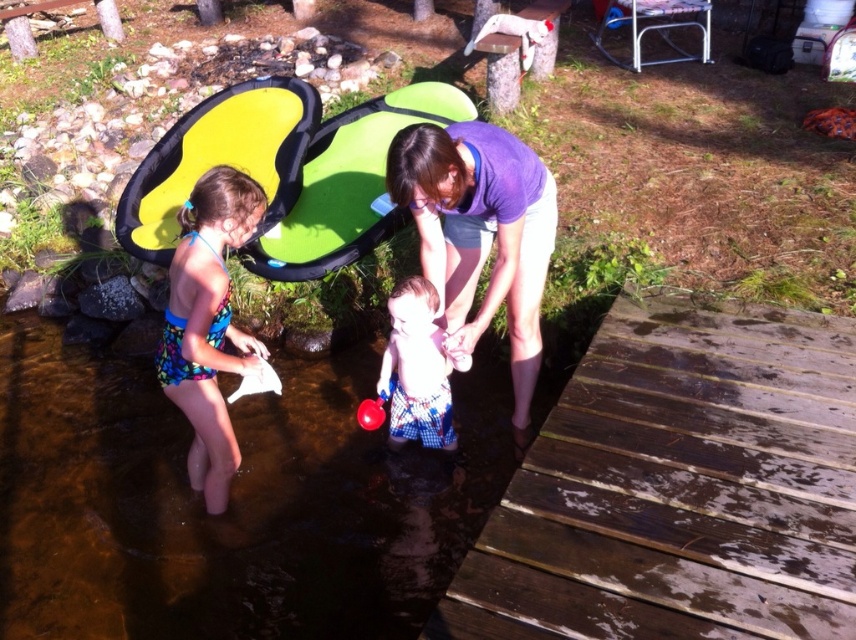
Can you confirm if brown wooden dock at lower right is bigger than purple cotton shirt at center?

Yes, brown wooden dock at lower right is bigger than purple cotton shirt at center.

Can you confirm if brown wooden dock at lower right is wider than purple cotton shirt at center?

Yes.

The image size is (856, 640). What are the coordinates of `brown wooden dock at lower right` in the screenshot? It's located at (679, 486).

The height and width of the screenshot is (640, 856). What do you see at coordinates (679, 486) in the screenshot?
I see `brown wooden dock at lower right` at bounding box center [679, 486].

Who is more distant from viewer, (x=649, y=625) or (x=391, y=404)?

Point (x=391, y=404)

Where is `brown wooden dock at lower right`? brown wooden dock at lower right is located at coordinates (679, 486).

Which of these two, purple cotton shirt at center or plaid shorts at center, stands shorter?

With less height is plaid shorts at center.

Is purple cotton shirt at center to the right of plaid shorts at center from the viewer's perspective?

Yes, purple cotton shirt at center is to the right of plaid shorts at center.

Is point (524, 236) positioned before point (443, 412)?

Yes, it is in front of point (443, 412).

The image size is (856, 640). In order to click on purple cotton shirt at center in this screenshot , I will do `click(480, 236)`.